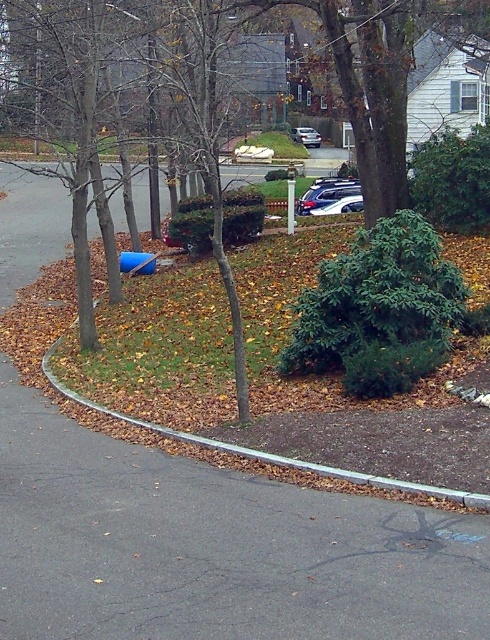
You are a delivery driver trying to park your truck, which is 2 meters wide, in the space between the green leafy tree at center and the satin silver sedan at center. Can your truck fit there?

The green leafy tree at center is wider than the satin silver sedan at center. However, the width of the tree and sedan themselves are not provided, so it is impossible to determine if the space between them is wide enough for a 2 meter wide truck.